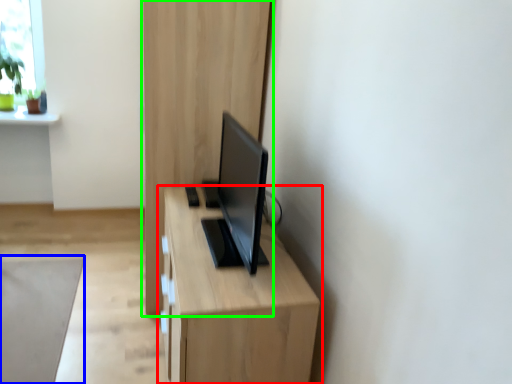
Question: Which object is the farthest from table (highlighted by a red box)? Choose among these: plain (highlighted by a blue box) or dresser (highlighted by a green box).

Choices:
 (A) plain
 (B) dresser

Answer: (A)